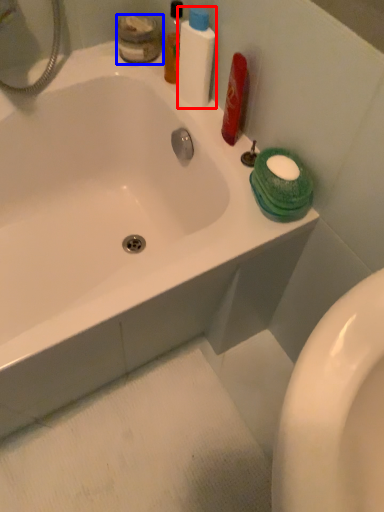
Question: Which object appears closest to the camera in this image, cleaning product (highlighted by a red box) or toiletry (highlighted by a blue box)?

Choices:
 (A) cleaning product
 (B) toiletry

Answer: (A)